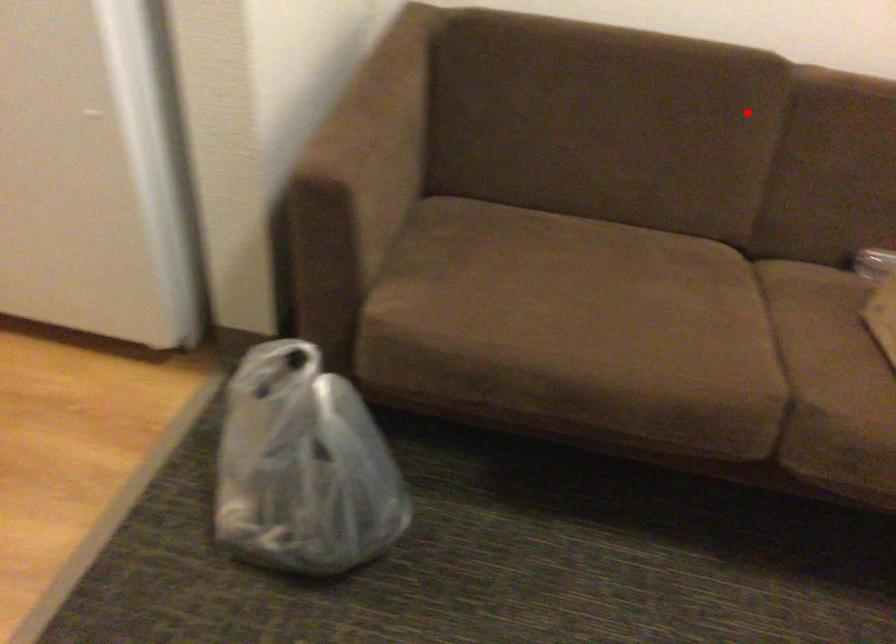
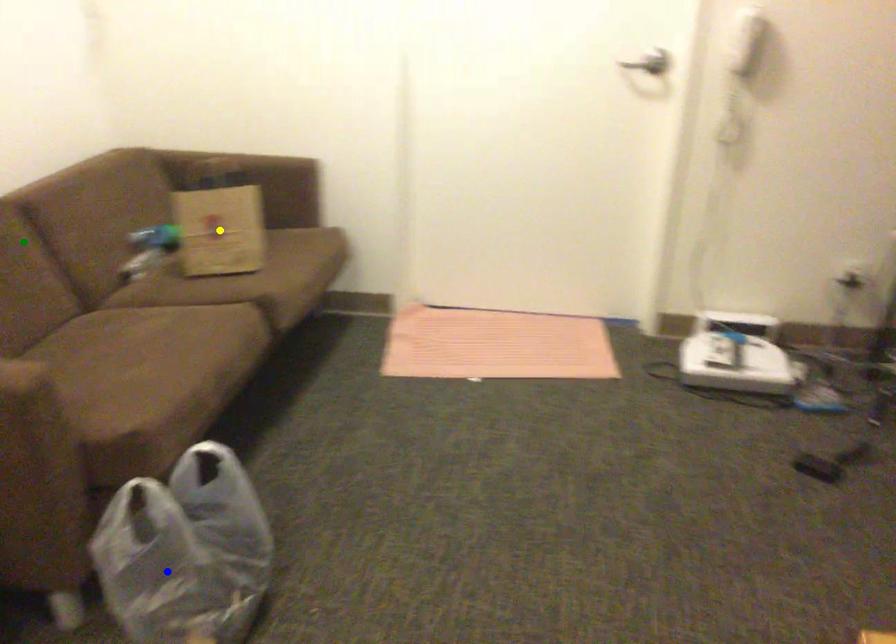
Question: I am providing you with two images of the same scene from different viewpoints. A red point is marked on the first image. You are given multiple points on the second image. Which spot in image 2 lines up with the point in image 1?

Choices:
 (A) green point
 (B) blue point
 (C) yellow point

Answer: (A)